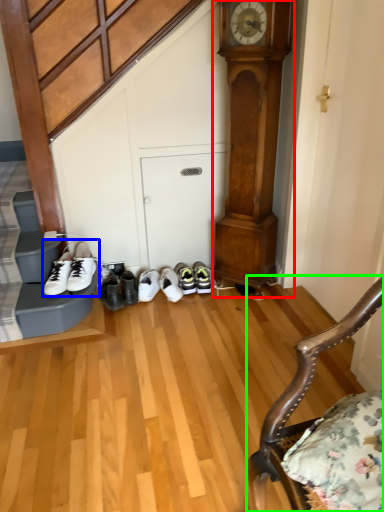
Question: Which object is the farthest from clock (highlighted by a red box)? Choose among these: footwear (highlighted by a blue box) or chair (highlighted by a green box).

Choices:
 (A) footwear
 (B) chair

Answer: (B)